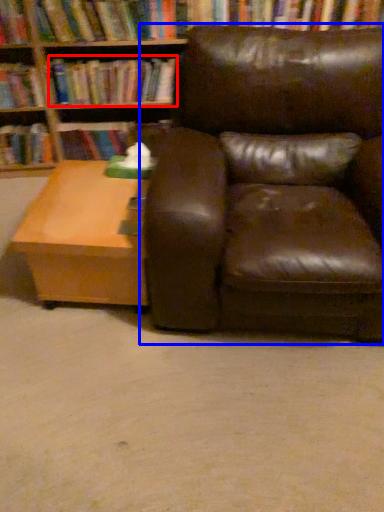
Question: Among these objects, which one is farthest to the camera, book (highlighted by a red box) or chair (highlighted by a blue box)?

Choices:
 (A) book
 (B) chair

Answer: (A)